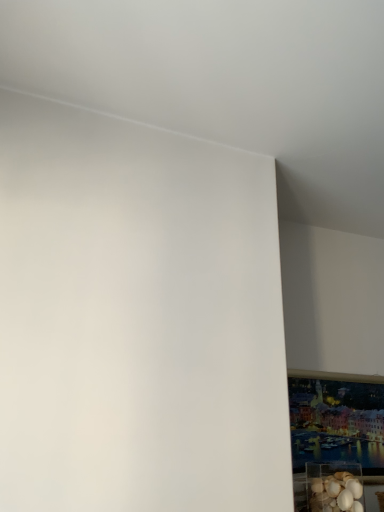
You are a GUI agent. You are given a task and a screenshot of the screen. Output one action in this format:
    pyautogui.click(x=<x>, y=<y>)
    Task: Click on the translucent plastic container at lower right
    This screenshot has width=384, height=512.
    Given the screenshot: What is the action you would take?
    pyautogui.click(x=336, y=493)

Image resolution: width=384 pixels, height=512 pixels. What do you see at coordinates (336, 493) in the screenshot? I see `translucent plastic container at lower right` at bounding box center [336, 493].

Locate an element on the screen. The image size is (384, 512). translucent plastic container at lower right is located at coordinates (336, 493).